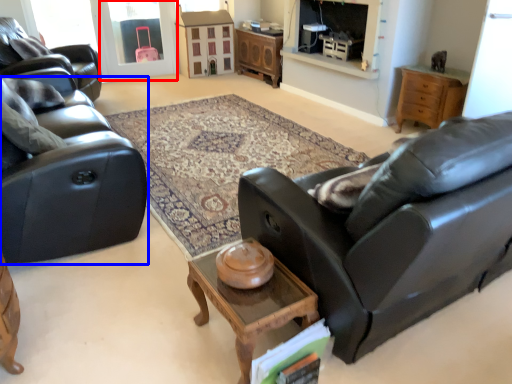
Question: Which point is closer to the camera, window screen (highlighted by a red box) or studio couch (highlighted by a blue box)?

Choices:
 (A) window screen
 (B) studio couch

Answer: (B)